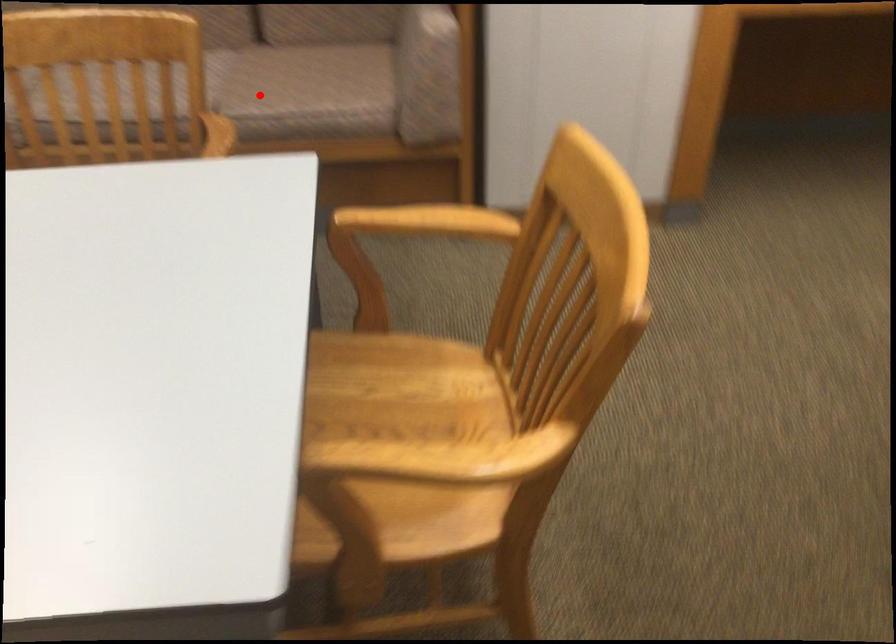
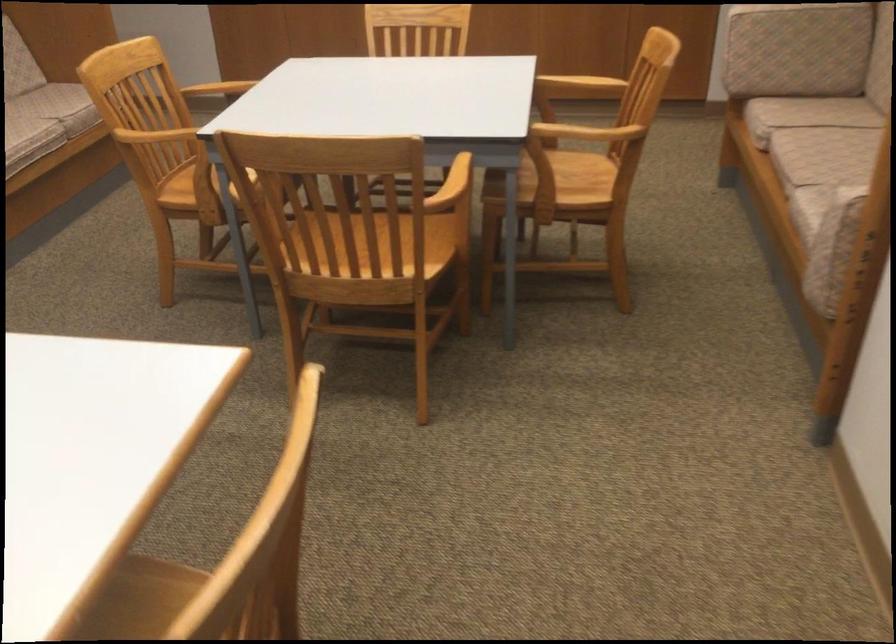
In the second image, find the point that corresponds to the highlighted location in the first image.

(822, 190)